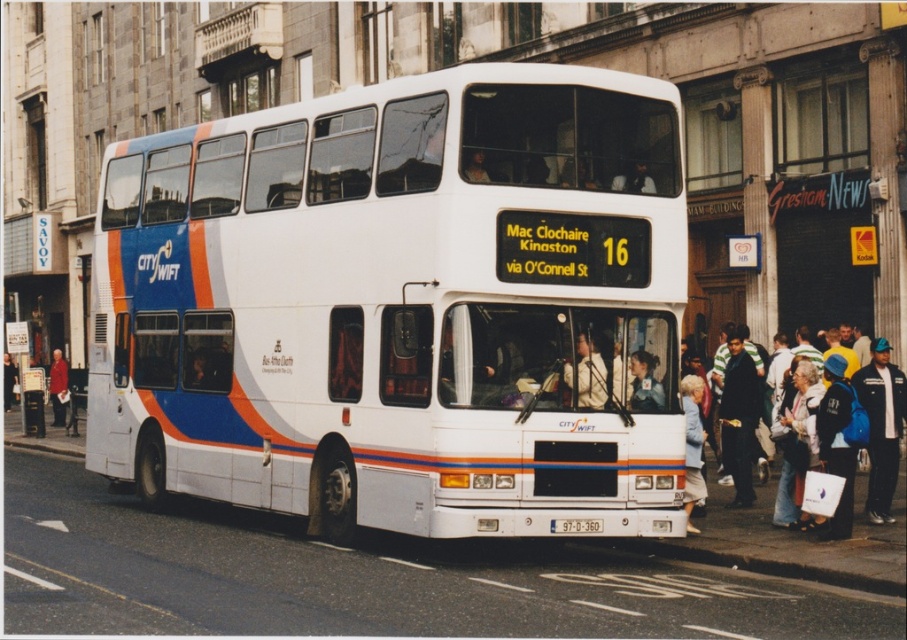
You are standing at the bus stop waiting for the CitySwift bus. You see the point marked at coordinates (837,440). What object is located at that point?

The point at coordinates (837,440) corresponds to the blue fabric jacket at lower right.

You are a pedestrian standing on the sidewalk next to the double decker bus. You notice two people nearby wearing the blue fabric jacket at lower right and the light blue shirt at center. Which person is closer to the front of the bus?

The blue fabric jacket at lower right is much taller than the light blue shirt at center, so the person wearing the blue fabric jacket at lower right is closer to the front of the bus.